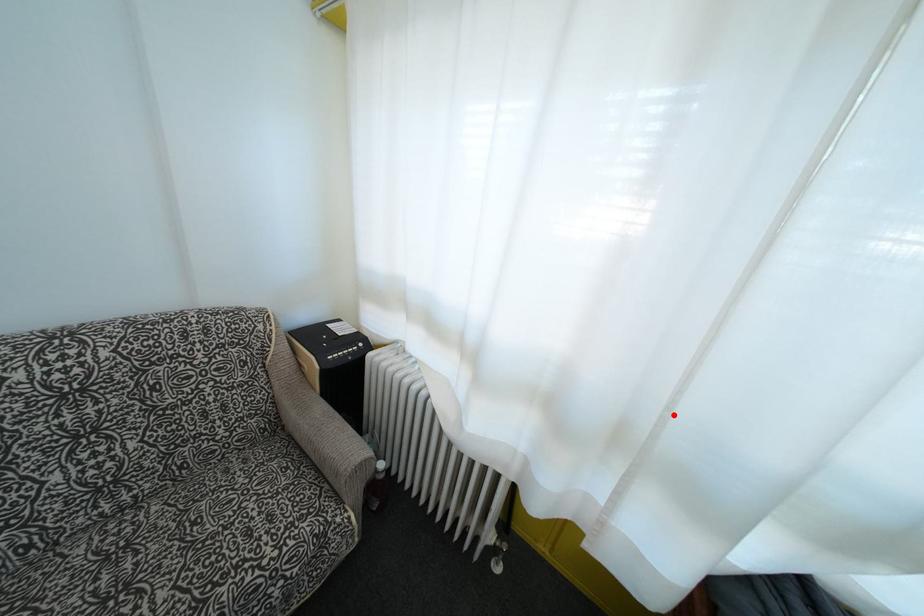
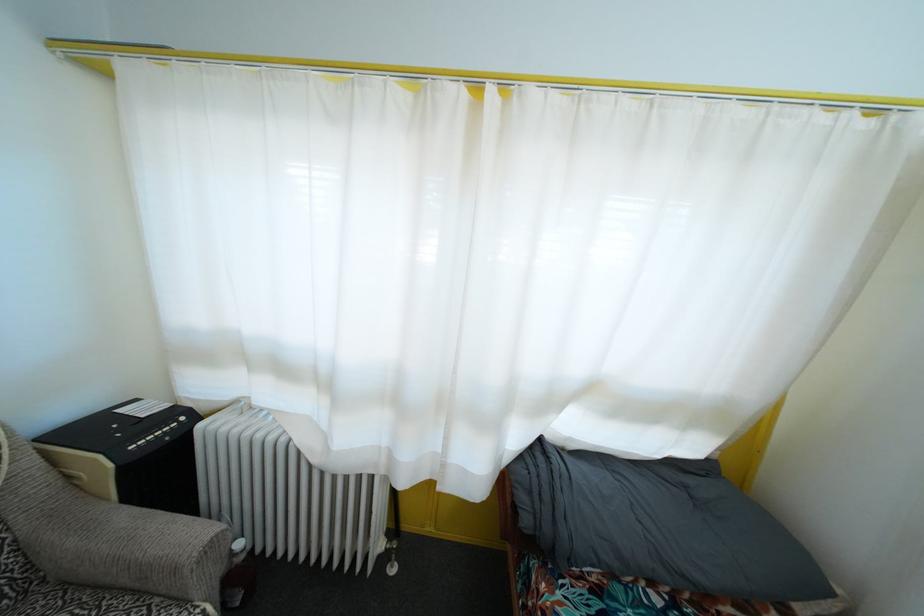
Question: I am providing you with two images of the same scene from different viewpoints. A red point is marked on the first image. At the location where the point appears in image 1, is it still visible in image 2?

Choices:
 (A) Yes
 (B) No

Answer: (A)